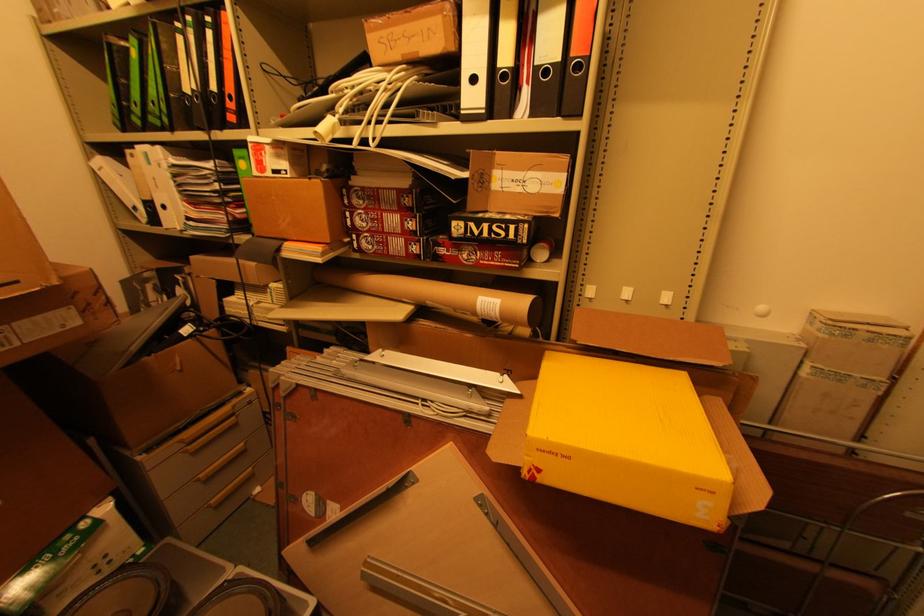
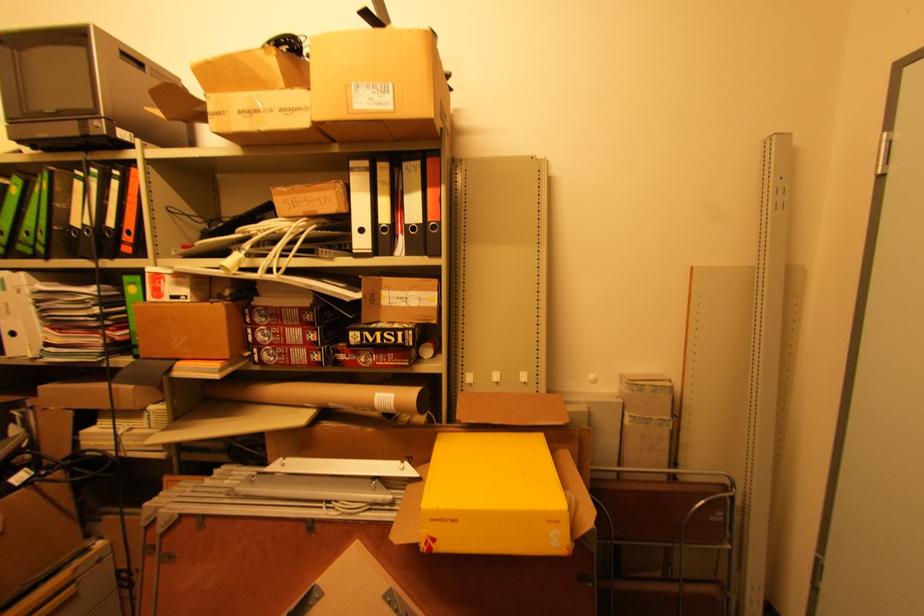
In the second image, find the point that corresponds to pixel 548 73 in the first image.

(417, 229)